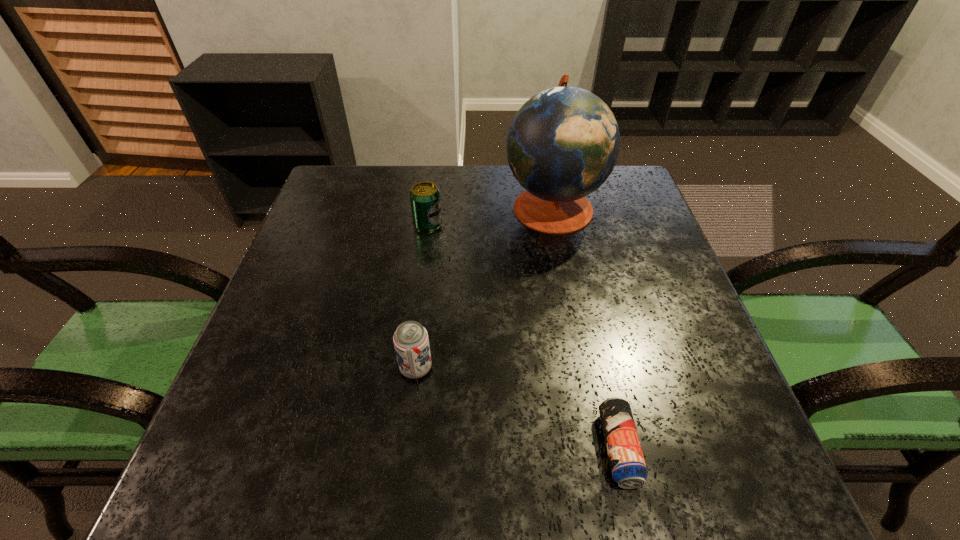
Where is `vacant space situated on the right of the nearest beer can`? vacant space situated on the right of the nearest beer can is located at coordinates (708, 448).

At what (x,y) coordinates should I click in order to perform the action: click on object that is positioned at the far edge. Please return your answer as a coordinate pair (x, y). This screenshot has height=540, width=960. Looking at the image, I should click on (563, 143).

At what (x,y) coordinates should I click in order to perform the action: click on object located at the near edge. Please return your answer as a coordinate pair (x, y). The height and width of the screenshot is (540, 960). Looking at the image, I should click on (627, 463).

What are the coordinates of `object that is positioned at the right edge` in the screenshot? It's located at (563, 143).

This screenshot has height=540, width=960. I want to click on object at the far right corner, so click(563, 143).

What are the coordinates of `free point at the far edge` in the screenshot? It's located at (395, 167).

I want to click on free spot at the near edge of the desktop, so click(503, 504).

This screenshot has width=960, height=540. In the image, there is a desktop. Find the location of `free space at the left edge`. free space at the left edge is located at coordinates (283, 275).

Locate an element on the screen. vacant space at the far left corner of the desktop is located at coordinates (360, 169).

Find the location of a particular element. The image size is (960, 540). free point at the near left corner is located at coordinates (253, 461).